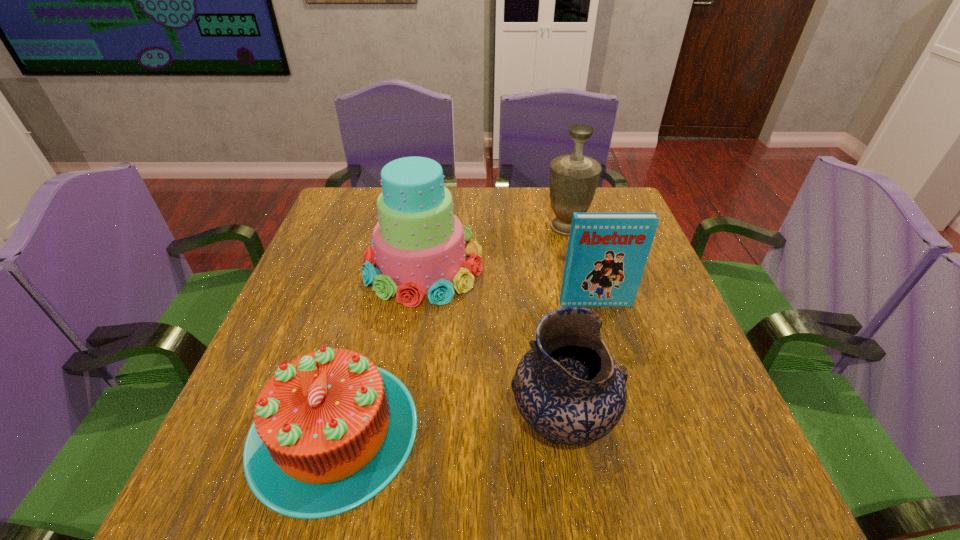
Identify the location of urn. (574, 177).

Image resolution: width=960 pixels, height=540 pixels. I want to click on the taller cake, so click(x=418, y=246).

I want to click on book, so click(607, 252).

At what (x,y) coordinates should I click in order to perform the action: click on pottery. Please return your answer as a coordinate pair (x, y). Looking at the image, I should click on (568, 388).

Identify the location of the nearer cake. The image size is (960, 540). (331, 430).

In order to click on the shortest object in this screenshot , I will do `click(331, 430)`.

Image resolution: width=960 pixels, height=540 pixels. I want to click on vacant space located 0.280m on the left of the urn, so click(444, 228).

Find the location of `vacant space located 0.210m on the front of the farther cake`. vacant space located 0.210m on the front of the farther cake is located at coordinates (405, 388).

I want to click on free point located on the front cover of the book, so click(602, 323).

Locate an element on the screen. This screenshot has width=960, height=540. vacant region located 0.230m on the back of the pottery is located at coordinates (542, 298).